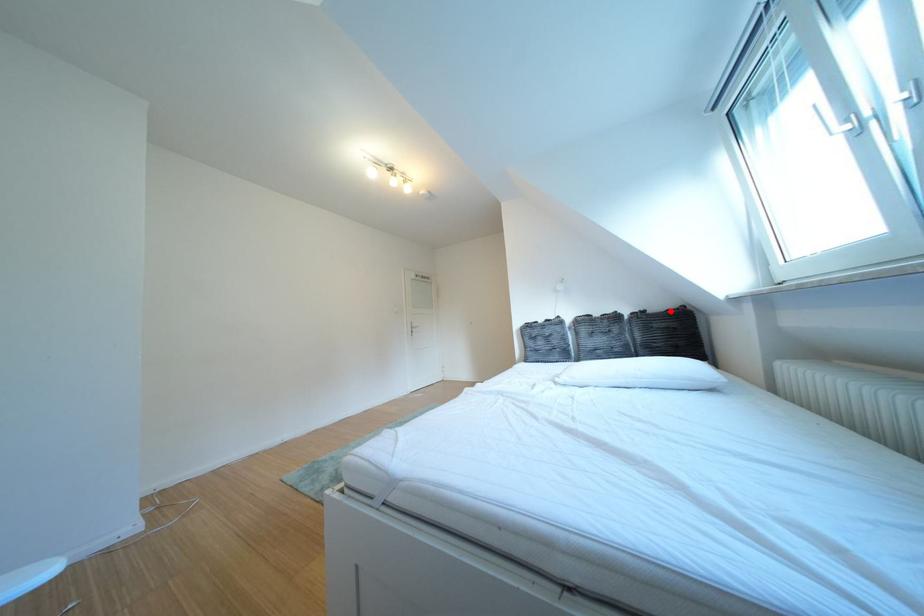
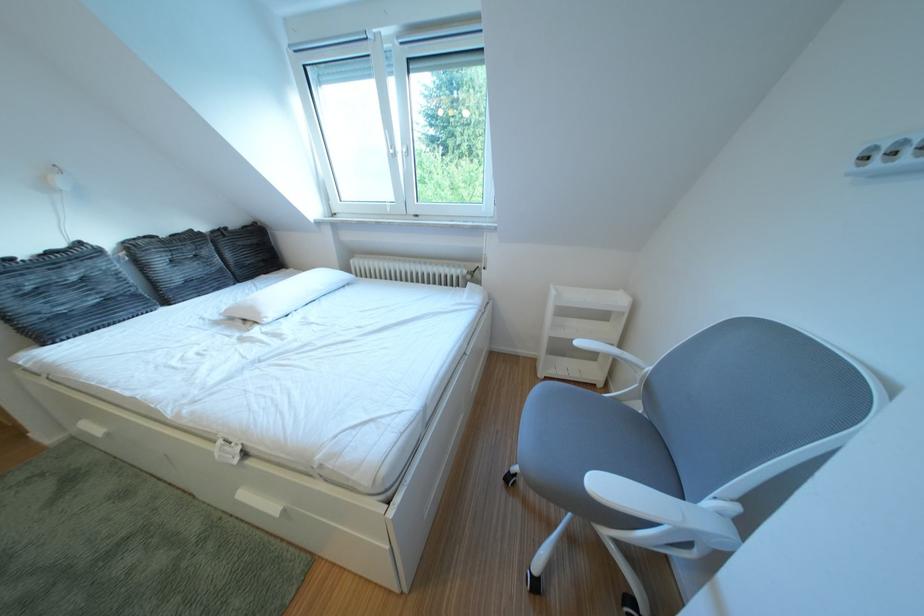
Question: I am providing you with two images of the same scene from different viewpoints. A red point is shown in image1. For the corresponding object point in image2, is it positioned nearer or farther from the camera?

Choices:
 (A) Nearer
 (B) Farther

Answer: (A)